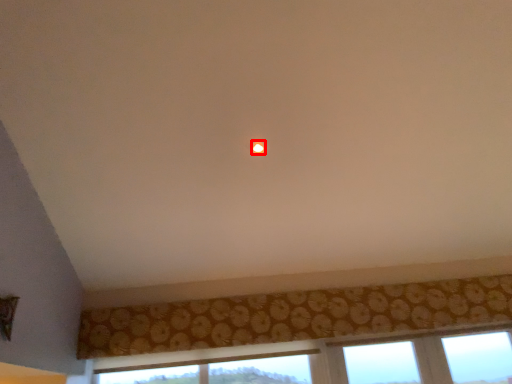
Question: Where is glow (annotated by the red box) located in relation to curtain in the image?

Choices:
 (A) left
 (B) right

Answer: (A)